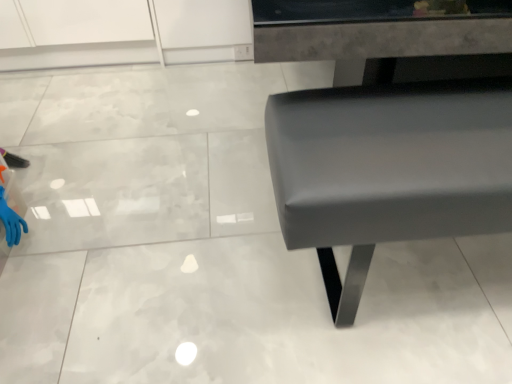
The image size is (512, 384). Describe the element at coordinates (388, 170) in the screenshot. I see `matte gray bench at center` at that location.

Where is `matte gray bench at center`? The height and width of the screenshot is (384, 512). matte gray bench at center is located at coordinates (388, 170).

What do you see at coordinates (11, 221) in the screenshot?
I see `blue rubber glove at lower left` at bounding box center [11, 221].

Measure the distance between point (0, 209) and camera.

Point (0, 209) is 1.45 meters away from camera.

Where is `blue rubber glove at lower left`? blue rubber glove at lower left is located at coordinates (11, 221).

Identify the location of matte gray bench at center. The width and height of the screenshot is (512, 384). (388, 170).

Does matte gray bench at center appear on the right side of blue rubber glove at lower left?

Yes.

Which is behind, matte gray bench at center or blue rubber glove at lower left?

blue rubber glove at lower left is further away from the camera.

Considering the points (395, 192) and (6, 226), which point is in front, point (395, 192) or point (6, 226)?

The point (395, 192) is in front.

From the image's perspective, relative to blue rubber glove at lower left, is matte gray bench at center above or below?

From the image's perspective, matte gray bench at center appears above blue rubber glove at lower left.

From a real-world perspective, which object rests below the other?

blue rubber glove at lower left, from a real-world perspective.

Considering the sizes of matte gray bench at center and blue rubber glove at lower left in the image, is matte gray bench at center wider or thinner than blue rubber glove at lower left?

Considering their sizes, matte gray bench at center looks broader than blue rubber glove at lower left.

Considering the sizes of objects matte gray bench at center and blue rubber glove at lower left in the image provided, who is taller, matte gray bench at center or blue rubber glove at lower left?

matte gray bench at center.

Considering the sizes of objects matte gray bench at center and blue rubber glove at lower left in the image provided, who is smaller, matte gray bench at center or blue rubber glove at lower left?

With smaller size is blue rubber glove at lower left.

Is matte gray bench at center completely or partially outside of blue rubber glove at lower left?

Indeed, matte gray bench at center is completely outside blue rubber glove at lower left.

Is matte gray bench at center next to blue rubber glove at lower left and touching it?

matte gray bench at center is not next to blue rubber glove at lower left, and they're not touching.

Is matte gray bench at center turned away from blue rubber glove at lower left?

No, matte gray bench at center is not facing the opposite direction of blue rubber glove at lower left.

How far apart are matte gray bench at center and blue rubber glove at lower left?

matte gray bench at center is 4.01 feet away from blue rubber glove at lower left.

This screenshot has height=384, width=512. In order to click on furniture located in front of the blue rubber glove at lower left in this screenshot , I will do `click(388, 170)`.

Between blue rubber glove at lower left and matte gray bench at center, which one appears on the left side from the viewer's perspective?

blue rubber glove at lower left is more to the left.

Is the depth of blue rubber glove at lower left less than that of matte gray bench at center?

No, blue rubber glove at lower left is further to the viewer.

Is point (6, 237) positioned in front of point (401, 185)?

That is False.

From the image's perspective, is blue rubber glove at lower left over matte gray bench at center?

No, from the image's perspective, blue rubber glove at lower left is not over matte gray bench at center.

From a real-world perspective, is blue rubber glove at lower left physically above matte gray bench at center?

No, from a real-world perspective, blue rubber glove at lower left is not on top of matte gray bench at center.

Considering the relative sizes of blue rubber glove at lower left and matte gray bench at center in the image provided, is blue rubber glove at lower left thinner than matte gray bench at center?

Correct, the width of blue rubber glove at lower left is less than that of matte gray bench at center.

Which of these two, blue rubber glove at lower left or matte gray bench at center, stands taller?

With more height is matte gray bench at center.

Looking at this image, considering the sizes of objects blue rubber glove at lower left and matte gray bench at center in the image provided, who is bigger, blue rubber glove at lower left or matte gray bench at center?

Bigger between the two is matte gray bench at center.

Does blue rubber glove at lower left contain matte gray bench at center?

No, matte gray bench at center is located outside of blue rubber glove at lower left.

Is blue rubber glove at lower left not close to matte gray bench at center?

blue rubber glove at lower left is far away from matte gray bench at center.

Is blue rubber glove at lower left oriented towards matte gray bench at center?

Yes, blue rubber glove at lower left faces towards matte gray bench at center.

Can you tell me how much blue rubber glove at lower left and matte gray bench at center differ in facing direction?

88.6 degrees.

How much distance is there between blue rubber glove at lower left and matte gray bench at center?

1.22 meters.

Identify the location of hand lying on the left of matte gray bench at center. (11, 221).

The width and height of the screenshot is (512, 384). In order to click on furniture that is above the blue rubber glove at lower left (from a real-world perspective) in this screenshot , I will do `click(388, 170)`.

You are a GUI agent. You are given a task and a screenshot of the screen. Output one action in this format:
    pyautogui.click(x=<x>, y=<y>)
    Task: Click on the hand lying on the left of matte gray bench at center
    The image size is (512, 384).
    Given the screenshot: What is the action you would take?
    pyautogui.click(x=11, y=221)